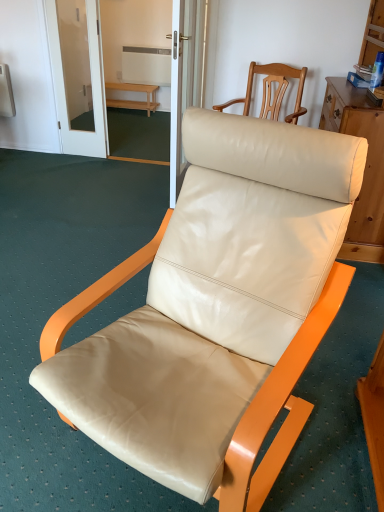
Question: Is light wood bench at center wider than beige leather chair at center, the 1th chair from the front?

Choices:
 (A) yes
 (B) no

Answer: (B)

Question: From the image's perspective, is light wood bench at center over beige leather chair at center, the first chair in the bottom-to-top sequence?

Choices:
 (A) no
 (B) yes

Answer: (B)

Question: Can you confirm if light wood bench at center is smaller than beige leather chair at center, the 1th chair from the front?

Choices:
 (A) no
 (B) yes

Answer: (B)

Question: Is light wood bench at center not near beige leather chair at center, which is the second chair in back-to-front order?

Choices:
 (A) yes
 (B) no

Answer: (A)

Question: Is light wood bench at center facing towards beige leather chair at center, the first chair in the bottom-to-top sequence?

Choices:
 (A) yes
 (B) no

Answer: (A)

Question: Considering the positions of point (109, 84) and point (243, 397), is point (109, 84) closer or farther from the camera than point (243, 397)?

Choices:
 (A) farther
 (B) closer

Answer: (A)

Question: From a real-world perspective, is light wood bench at center physically located above or below beige leather chair at center, which is counted as the 2th chair, starting from the top?

Choices:
 (A) below
 (B) above

Answer: (A)

Question: Relative to beige leather chair at center, the 1th chair from the front, is light wood bench at center in front or behind?

Choices:
 (A) behind
 (B) front

Answer: (A)

Question: Is light wood bench at center spatially inside beige leather chair at center, the 1th chair from the front, or outside of it?

Choices:
 (A) inside
 (B) outside

Answer: (B)

Question: Is point (125, 90) closer or farther from the camera than point (261, 114)?

Choices:
 (A) farther
 (B) closer

Answer: (A)

Question: Is light wood bench at center taller or shorter than beige leather chair at upper right, the second chair positioned from the front?

Choices:
 (A) short
 (B) tall

Answer: (A)

Question: Do you think light wood bench at center is within beige leather chair at upper right, positioned as the 1th chair in top-to-bottom order, or outside of it?

Choices:
 (A) inside
 (B) outside

Answer: (B)

Question: Is light wood bench at center wider or thinner than beige leather chair at upper right, which is counted as the 1th chair, starting from the back?

Choices:
 (A) thin
 (B) wide

Answer: (A)

Question: From the image's perspective, relative to transparent glass screen door at upper center, is beige leather chair at upper right, arranged as the 2th chair when ordered from the bottom, above or below?

Choices:
 (A) below
 (B) above

Answer: (A)

Question: Does point (271, 78) appear closer or farther from the camera than point (97, 44)?

Choices:
 (A) closer
 (B) farther

Answer: (A)